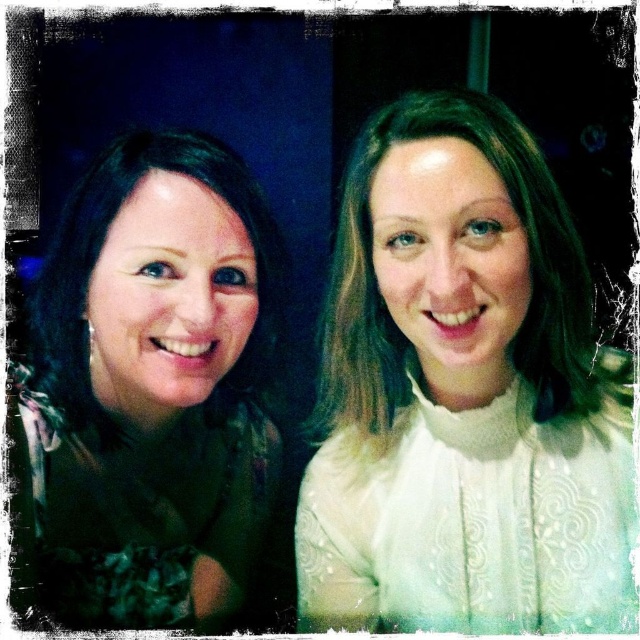
Question: Is white lace blouse at right above matte green dress at left?

Choices:
 (A) no
 (B) yes

Answer: (B)

Question: Among these objects, which one is farthest from the camera?

Choices:
 (A) white lace blouse at right
 (B) matte green dress at left

Answer: (B)

Question: Which of the following is the farthest from the observer?

Choices:
 (A) matte green dress at left
 (B) white lace blouse at right

Answer: (A)

Question: Is white lace blouse at right positioned behind matte green dress at left?

Choices:
 (A) no
 (B) yes

Answer: (A)

Question: Is white lace blouse at right thinner than matte green dress at left?

Choices:
 (A) yes
 (B) no

Answer: (B)